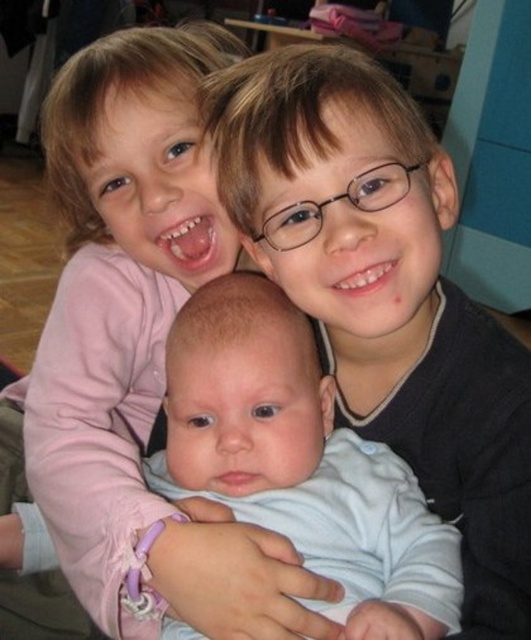
Between matte black sweater at center and light blue fabric baby at center, which one is positioned higher?

Positioned higher is matte black sweater at center.

Can you confirm if matte black sweater at center is thinner than light blue fabric baby at center?

In fact, matte black sweater at center might be wider than light blue fabric baby at center.

What do you see at coordinates (386, 294) in the screenshot? This screenshot has height=640, width=531. I see `matte black sweater at center` at bounding box center [386, 294].

You are a GUI agent. You are given a task and a screenshot of the screen. Output one action in this format:
    pyautogui.click(x=<x>, y=<y>)
    Task: Click on the matte black sweater at center
    The width and height of the screenshot is (531, 640).
    Given the screenshot: What is the action you would take?
    coord(386,294)

Where is `matte pink shirt at upper left`? This screenshot has width=531, height=640. matte pink shirt at upper left is located at coordinates (115, 300).

Does matte black sweater at center have a smaller size compared to matte pink shirt at upper left?

Yes.

How far apart are matte black sweater at center and matte pink shirt at upper left?

matte black sweater at center is 9.49 inches away from matte pink shirt at upper left.

Between point (371, 337) and point (199, 284), which one is positioned in front?

Point (371, 337) is more forward.

Locate an element on the screen. matte black sweater at center is located at coordinates (386, 294).